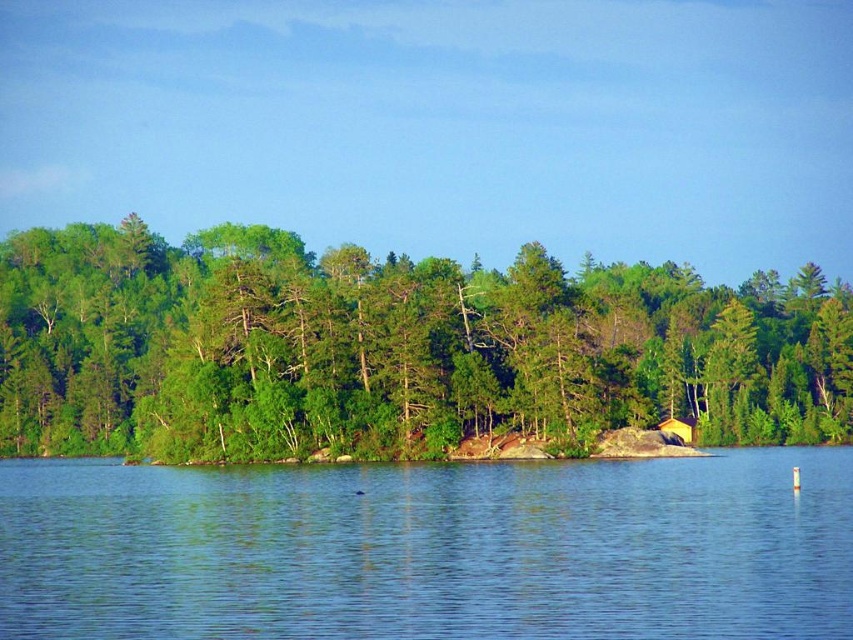
Consider the image. Can you confirm if green leafy trees at center is bigger than clear blue water at center?

Indeed, green leafy trees at center has a larger size compared to clear blue water at center.

Who is positioned more to the right, green leafy trees at center or clear blue water at center?

From the viewer's perspective, green leafy trees at center appears more on the right side.

This screenshot has height=640, width=853. What do you see at coordinates (393, 349) in the screenshot?
I see `green leafy trees at center` at bounding box center [393, 349].

Locate an element on the screen. green leafy trees at center is located at coordinates (393, 349).

Based on the photo, between green leafy trees at center and yellow wood hut at center, which one appears on the left side from the viewer's perspective?

green leafy trees at center

Is point (473, 273) farther from viewer compared to point (683, 428)?

Yes, point (473, 273) is farther from viewer.

Does point (778, 324) come behind point (666, 417)?

Yes.

Locate an element on the screen. The width and height of the screenshot is (853, 640). green leafy trees at center is located at coordinates (393, 349).

The image size is (853, 640). What do you see at coordinates (430, 548) in the screenshot?
I see `clear blue water at center` at bounding box center [430, 548].

Does clear blue water at center have a lesser width compared to yellow wood hut at center?

In fact, clear blue water at center might be wider than yellow wood hut at center.

Does point (801, 545) lie in front of point (694, 440)?

That is True.

You are a GUI agent. You are given a task and a screenshot of the screen. Output one action in this format:
    pyautogui.click(x=<x>, y=<y>)
    Task: Click on the clear blue water at center
    This screenshot has height=640, width=853.
    Given the screenshot: What is the action you would take?
    pyautogui.click(x=430, y=548)